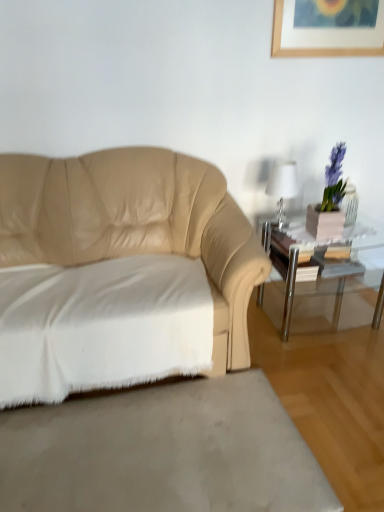
The image size is (384, 512). Find the location of `vacant region below clear glass table at right (from a real-world perspective)`. vacant region below clear glass table at right (from a real-world perspective) is located at coordinates (326, 312).